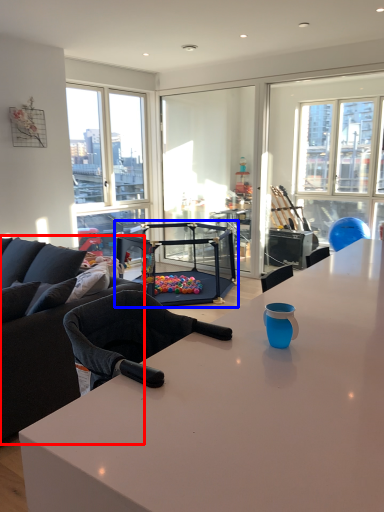
Question: Which of the following is the farthest to the observer, studio couch (highlighted by a red box) or equipment (highlighted by a blue box)?

Choices:
 (A) studio couch
 (B) equipment

Answer: (B)